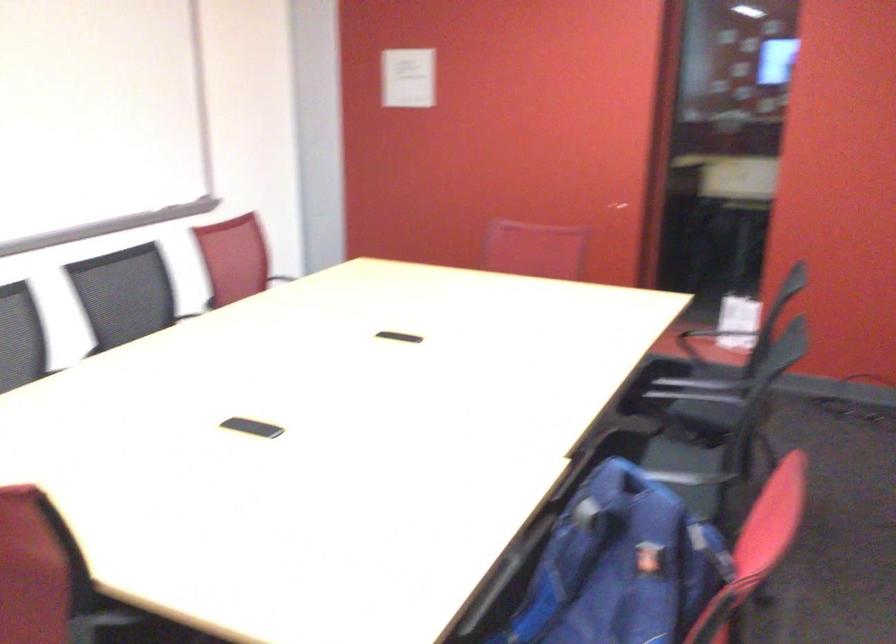
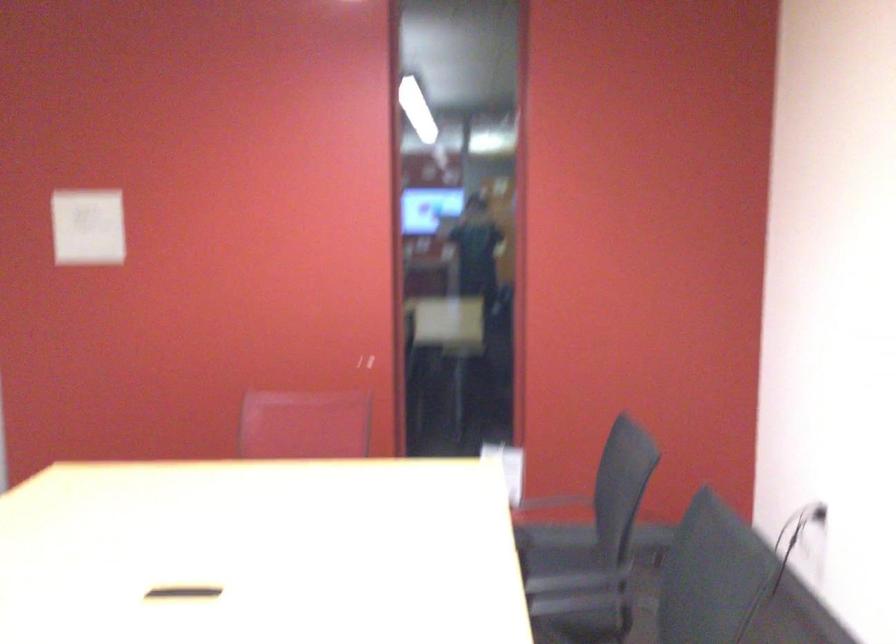
Locate, in the second image, the point that corresponds to the point at 785,388 in the first image.

(554, 547)